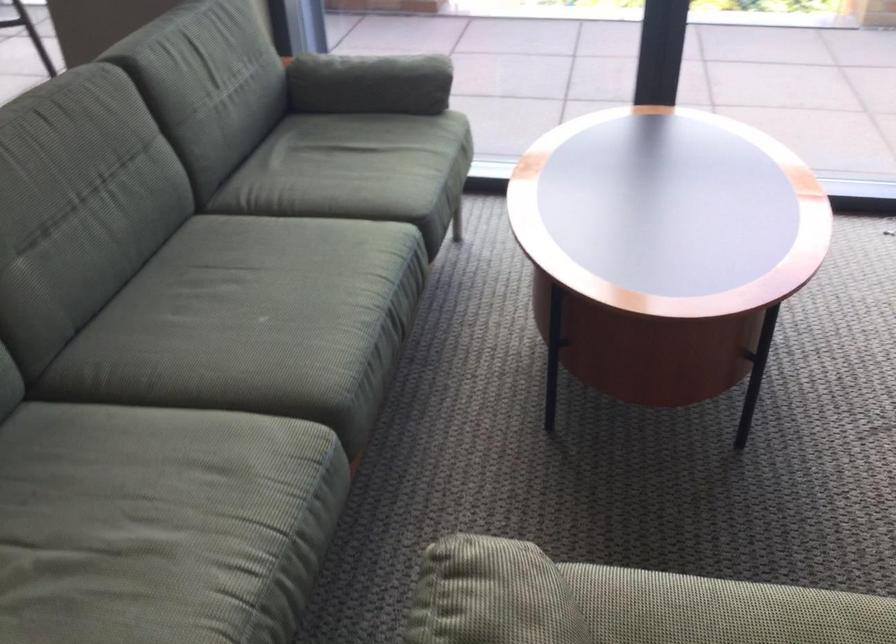
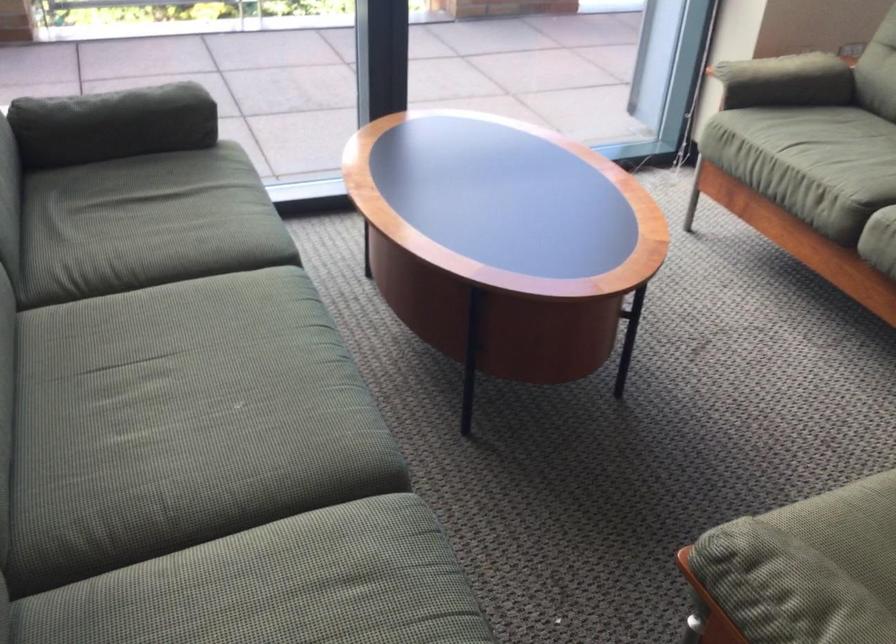
The point at (x=207, y=339) is marked in the first image. Where is the corresponding point in the second image?

(197, 446)